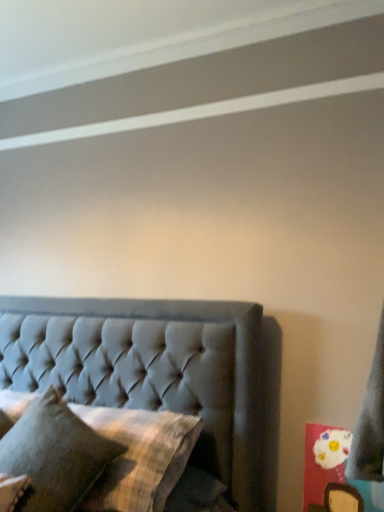
Question: Does textured gray pillow at lower left, the second pillow positioned from the bottom, have a lesser width compared to plaid fabric pillow at center, positioned as the second pillow in top-to-bottom order?

Choices:
 (A) yes
 (B) no

Answer: (B)

Question: From the image's perspective, is textured gray pillow at lower left, the second pillow positioned from the bottom, over plaid fabric pillow at center, arranged as the 1th pillow when ordered from the bottom?

Choices:
 (A) no
 (B) yes

Answer: (B)

Question: Considering the relative sizes of textured gray pillow at lower left, the second pillow positioned from the bottom, and plaid fabric pillow at center, arranged as the 1th pillow when ordered from the bottom, in the image provided, is textured gray pillow at lower left, the second pillow positioned from the bottom, shorter than plaid fabric pillow at center, arranged as the 1th pillow when ordered from the bottom,?

Choices:
 (A) no
 (B) yes

Answer: (A)

Question: Is textured gray pillow at lower left, the second pillow positioned from the bottom, looking in the opposite direction of plaid fabric pillow at center, positioned as the second pillow in top-to-bottom order?

Choices:
 (A) no
 (B) yes

Answer: (B)

Question: Is textured gray pillow at lower left, the second pillow positioned from the bottom, surrounding plaid fabric pillow at center, positioned as the second pillow in top-to-bottom order?

Choices:
 (A) yes
 (B) no

Answer: (B)

Question: Is plaid fabric pillow at center, arranged as the 1th pillow when ordered from the bottom, wider or thinner than tufted fabric bed at center?

Choices:
 (A) wide
 (B) thin

Answer: (B)

Question: Relative to tufted fabric bed at center, is plaid fabric pillow at center, arranged as the 1th pillow when ordered from the bottom, in front or behind?

Choices:
 (A) behind
 (B) front

Answer: (A)

Question: From their relative heights in the image, would you say plaid fabric pillow at center, positioned as the second pillow in top-to-bottom order, is taller or shorter than tufted fabric bed at center?

Choices:
 (A) tall
 (B) short

Answer: (B)

Question: Would you say plaid fabric pillow at center, positioned as the second pillow in top-to-bottom order, is inside or outside tufted fabric bed at center?

Choices:
 (A) outside
 (B) inside

Answer: (B)

Question: Choose the correct answer: Is textured gray pillow at lower left, which appears as the first pillow when viewed from the top, inside plaid fabric pillow at center, positioned as the second pillow in top-to-bottom order, or outside it?

Choices:
 (A) outside
 (B) inside

Answer: (A)

Question: Visually, is textured gray pillow at lower left, the second pillow positioned from the bottom, positioned to the left or to the right of plaid fabric pillow at center, positioned as the second pillow in top-to-bottom order?

Choices:
 (A) right
 (B) left

Answer: (B)

Question: Looking at their shapes, would you say textured gray pillow at lower left, which appears as the first pillow when viewed from the top, is wider or thinner than plaid fabric pillow at center, positioned as the second pillow in top-to-bottom order?

Choices:
 (A) thin
 (B) wide

Answer: (B)

Question: Is point (99, 442) positioned closer to the camera than point (168, 493)?

Choices:
 (A) farther
 (B) closer

Answer: (B)

Question: Would you say plaid fabric pillow at center, positioned as the second pillow in top-to-bottom order, is inside or outside textured gray pillow at lower left, which appears as the first pillow when viewed from the top?

Choices:
 (A) inside
 (B) outside

Answer: (B)

Question: From the image's perspective, is plaid fabric pillow at center, positioned as the second pillow in top-to-bottom order, located above or below textured gray pillow at lower left, which appears as the first pillow when viewed from the top?

Choices:
 (A) below
 (B) above

Answer: (A)